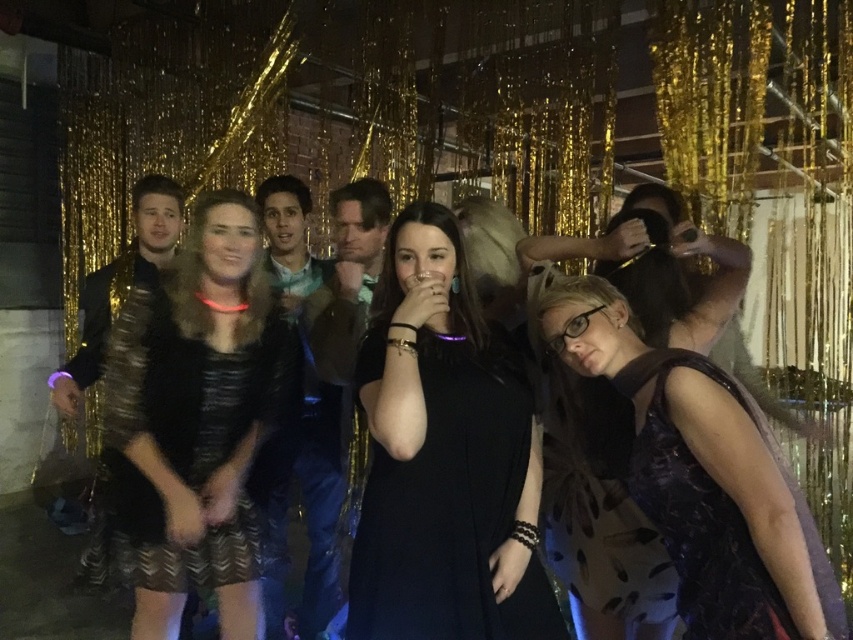
Question: Does black matte dress at center have a lesser width compared to shiny black jacket at left?

Choices:
 (A) yes
 (B) no

Answer: (B)

Question: Which object is the farthest from the shiny black jacket at left?

Choices:
 (A) shiny black dress at center
 (B) shiny blue jacket at center
 (C) black matte dress at center

Answer: (C)

Question: Observing the image, what is the correct spatial positioning of shiny black dress at center in reference to shiny blue jacket at center?

Choices:
 (A) below
 (B) above

Answer: (B)

Question: Which point is farther from the camera taking this photo?

Choices:
 (A) (340, 454)
 (B) (163, 228)
 (C) (306, 522)
 (D) (219, 312)

Answer: (C)

Question: Which of the following is the closest to the observer?

Choices:
 (A) shiny blue shirt at center
 (B) shiny black dress at center
 (C) shiny blue jacket at center
 (D) shiny black jacket at left

Answer: (B)

Question: Is black matte dress at center closer to camera compared to matte black dress at center?

Choices:
 (A) yes
 (B) no

Answer: (B)